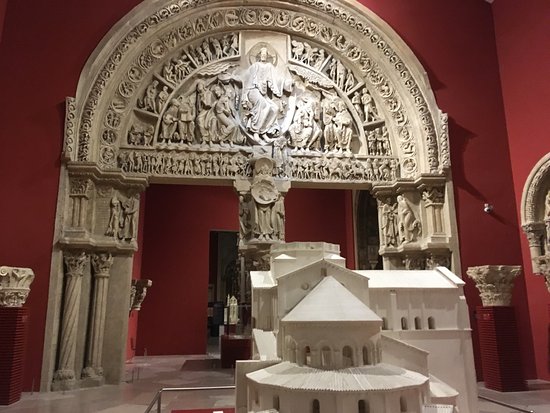
You are a GUI agent. You are given a task and a screenshot of the screen. Output one action in this format:
    pyautogui.click(x=<x>, y=<y>)
    Task: Click on the marble floor
    The image size is (550, 413).
    Given the screenshot: What is the action you would take?
    point(117,401), point(534,405)